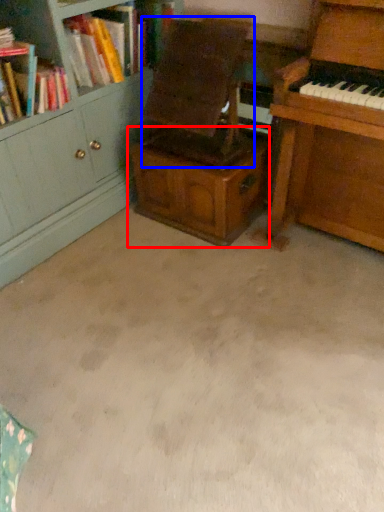
Question: Which object is closer to the camera taking this photo, cabinetry (highlighted by a red box) or armchair (highlighted by a blue box)?

Choices:
 (A) cabinetry
 (B) armchair

Answer: (B)